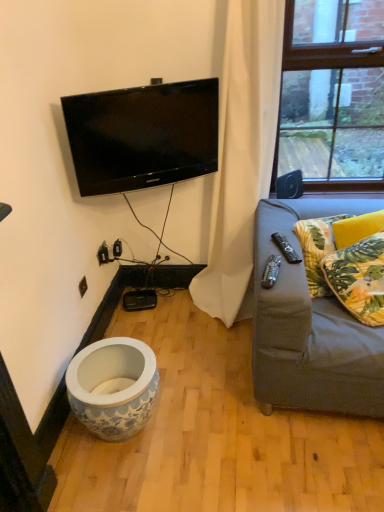
Question: In terms of width, does yellow floral fabric pillow at right, the second pillow positioned from the front, look wider or thinner when compared to dark gray fabric couch at right?

Choices:
 (A) wide
 (B) thin

Answer: (B)

Question: From the image's perspective, is yellow floral fabric pillow at right, marked as the first pillow in a back-to-front arrangement, positioned above or below dark gray fabric couch at right?

Choices:
 (A) below
 (B) above

Answer: (B)

Question: Which of these objects is positioned farthest from the dark gray fabric couch at right?

Choices:
 (A) black glossy tv at upper center
 (B) white fabric curtain at upper right
 (C) white glossy vase at lower left
 (D) green leafy fabric pillow at right, which is the second pillow in back-to-front order
 (E) yellow floral fabric pillow at right, marked as the first pillow in a back-to-front arrangement

Answer: (A)

Question: Which object is the closest to the black glossy tv at upper center?

Choices:
 (A) white fabric curtain at upper right
 (B) yellow floral fabric pillow at right, the second pillow positioned from the front
 (C) white glossy vase at lower left
 (D) dark gray fabric couch at right
 (E) black plastic remote at right

Answer: (A)